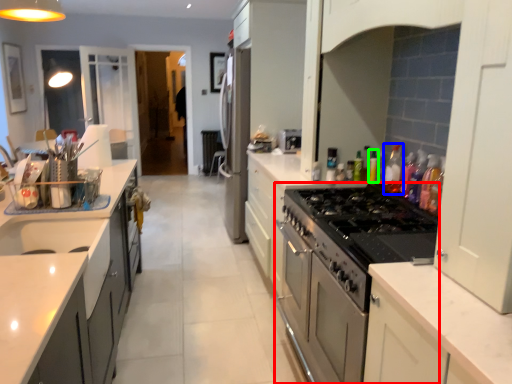
Question: Based on their relative distances, which object is farther from appliance (highlighted by a red box)? Choose from bottle (highlighted by a blue box) and bottle (highlighted by a green box).

Choices:
 (A) bottle
 (B) bottle

Answer: (B)